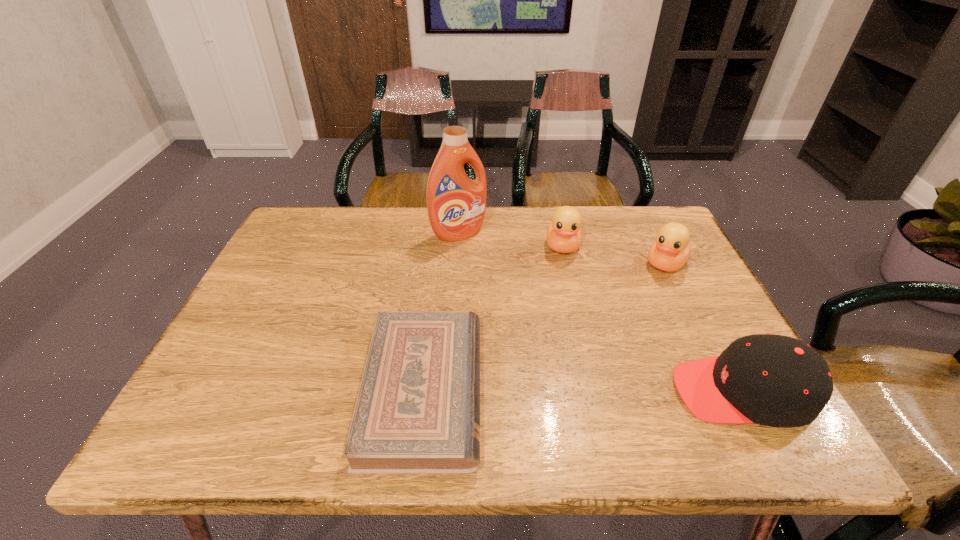
I want to click on cap that is at the near edge, so click(x=775, y=380).

Identify the location of cap situated at the right edge. This screenshot has width=960, height=540. (775, 380).

You are a GUI agent. You are given a task and a screenshot of the screen. Output one action in this format:
    pyautogui.click(x=<x>, y=<y>)
    Task: Click on the duckling that is at the right edge
    The width and height of the screenshot is (960, 540).
    Given the screenshot: What is the action you would take?
    [x=669, y=252]

Locate an element on the screen. The image size is (960, 540). object that is at the far right corner is located at coordinates (669, 252).

Locate an element on the screen. object at the near right corner is located at coordinates (775, 380).

In the image, there is a desktop. Where is `free space at the far edge`? This screenshot has width=960, height=540. free space at the far edge is located at coordinates (430, 232).

The image size is (960, 540). I want to click on vacant space at the near edge, so click(x=351, y=388).

In the image, there is a desktop. Where is `free space at the right edge`? Image resolution: width=960 pixels, height=540 pixels. free space at the right edge is located at coordinates (667, 343).

This screenshot has height=540, width=960. Find the location of `vacant space at the far left corner`. vacant space at the far left corner is located at coordinates (309, 249).

Locate an element on the screen. blank area at the far right corner is located at coordinates (658, 223).